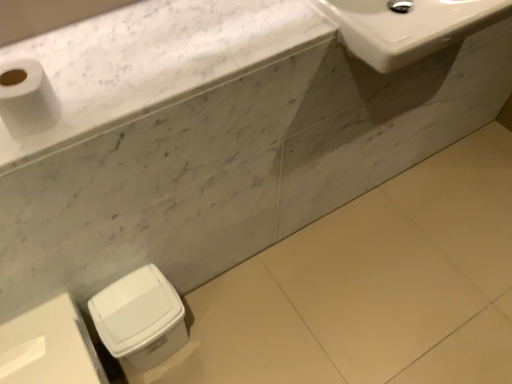
I want to click on white matte toilet paper at upper left, so click(27, 98).

I want to click on white glossy sink at upper right, so click(x=407, y=26).

Describe the element at coordinates (140, 318) in the screenshot. The width and height of the screenshot is (512, 384). I see `white plastic trash can at lower left, marked as the second porcelain in a left-to-right arrangement` at that location.

What is the approximate height of white plastic trash can at lower left, the 2th porcelain from the right?

The height of white plastic trash can at lower left, the 2th porcelain from the right, is 17.52 inches.

The height and width of the screenshot is (384, 512). I want to click on white matte toilet paper at upper left, so click(x=27, y=98).

Is white marble countertop at upper left in contact with white glossy sink at upper right?

white marble countertop at upper left and white glossy sink at upper right are clearly separated.

Which is in front, point (310, 11) or point (414, 50)?

The point (414, 50) is closer to the camera.

From the image's perspective, is white marble countertop at upper left below white glossy sink at upper right?

Indeed, from the image's perspective, white marble countertop at upper left is shown beneath white glossy sink at upper right.

Is the position of white marble countertop at upper left less distant than that of white glossy sink at upper right?

Yes, white marble countertop at upper left is closer to the viewer.

Which is more to the left, white plastic trash can at lower left, marked as the 1th porcelain in a right-to-left arrangement, or white matte toilet paper at upper left?

white matte toilet paper at upper left.

Does point (155, 301) lie behind point (3, 116)?

Yes, it is.

How different are the orientations of white plastic trash can at lower left, marked as the 1th porcelain in a right-to-left arrangement, and white matte toilet paper at upper left in degrees?

The facing directions of white plastic trash can at lower left, marked as the 1th porcelain in a right-to-left arrangement, and white matte toilet paper at upper left are 0.562 degrees apart.

From the image's perspective, which object appears higher, white plastic trash can at lower left, marked as the 1th porcelain in a right-to-left arrangement, or white matte toilet paper at upper left?

white matte toilet paper at upper left.

Where is `porcelain lying above the white plastic trash can at lower left, the 2th porcelain from the right (from the image's perspective)`? This screenshot has width=512, height=384. porcelain lying above the white plastic trash can at lower left, the 2th porcelain from the right (from the image's perspective) is located at coordinates (140, 318).

Considering the positions of points (66, 356) and (174, 337), is point (66, 356) farther from camera compared to point (174, 337)?

No, (66, 356) is in front of (174, 337).

From the image's perspective, who appears lower, white plastic trash can at lower left, the 2th porcelain from the right, or white plastic trash can at lower left, marked as the second porcelain in a left-to-right arrangement?

white plastic trash can at lower left, the 2th porcelain from the right.

Looking at this image, from a real-world perspective, is white plastic trash can at lower left, the first porcelain viewed from the left, positioned under white matte toilet paper at upper left based on gravity?

Yes, from a real-world perspective, white plastic trash can at lower left, the first porcelain viewed from the left, is beneath white matte toilet paper at upper left.

Does point (90, 375) appear closer or farther from the camera than point (32, 108)?

Point (90, 375) is positioned farther from the camera compared to point (32, 108).

Considering their positions, is white plastic trash can at lower left, the 2th porcelain from the right, located in front of or behind white matte toilet paper at upper left?

Visually, white plastic trash can at lower left, the 2th porcelain from the right, is located behind white matte toilet paper at upper left.

Is white plastic trash can at lower left, the 2th porcelain from the right, looking in the opposite direction of white matte toilet paper at upper left?

white plastic trash can at lower left, the 2th porcelain from the right, does not have its back to white matte toilet paper at upper left.

Is white plastic trash can at lower left, marked as the 1th porcelain in a right-to-left arrangement, spatially inside white marble countertop at upper left, or outside of it?

white plastic trash can at lower left, marked as the 1th porcelain in a right-to-left arrangement, exists outside the volume of white marble countertop at upper left.

This screenshot has height=384, width=512. I want to click on the 1st porcelain positioned below the white marble countertop at upper left (from the image's perspective), so pos(140,318).

From the image's perspective, does white plastic trash can at lower left, marked as the 1th porcelain in a right-to-left arrangement, appear higher than white marble countertop at upper left?

No, from the image's perspective, white plastic trash can at lower left, marked as the 1th porcelain in a right-to-left arrangement, is not on top of white marble countertop at upper left.

Is white plastic trash can at lower left, marked as the second porcelain in a left-to-right arrangement, oriented away from white marble countertop at upper left?

That's not correct — white plastic trash can at lower left, marked as the second porcelain in a left-to-right arrangement, is not looking away from white marble countertop at upper left.

In the scene shown: Is white marble countertop at upper left directly adjacent to white matte toilet paper at upper left?

There is a gap between white marble countertop at upper left and white matte toilet paper at upper left.

Could you measure the distance between white marble countertop at upper left and white matte toilet paper at upper left?

white marble countertop at upper left is 9.57 inches away from white matte toilet paper at upper left.

Is white marble countertop at upper left closer to the viewer compared to white matte toilet paper at upper left?

No, white marble countertop at upper left is further to the viewer.

Which is in front, point (220, 52) or point (11, 108)?

The point (11, 108) is in front.

Considering the relative sizes of white glossy sink at upper right and white marble countertop at upper left in the image provided, is white glossy sink at upper right wider than white marble countertop at upper left?

Indeed, white glossy sink at upper right has a greater width compared to white marble countertop at upper left.

Between white glossy sink at upper right and white marble countertop at upper left, which one has larger size?

Bigger between the two is white glossy sink at upper right.

How distant is white glossy sink at upper right from white marble countertop at upper left?

29.35 centimeters.

Can you see white glossy sink at upper right touching white marble countertop at upper left?

No, white glossy sink at upper right is not next to white marble countertop at upper left.

This screenshot has width=512, height=384. I want to click on counter top above the white glossy sink at upper right (from a real-world perspective), so click(x=153, y=61).

This screenshot has width=512, height=384. I want to click on toilet paper above the white plastic trash can at lower left, marked as the second porcelain in a left-to-right arrangement (from the image's perspective), so click(x=27, y=98).

Which object lies nearer to the anchor point white glossy sink at upper right, white plastic trash can at lower left, marked as the 1th porcelain in a right-to-left arrangement, or white matte toilet paper at upper left?

white matte toilet paper at upper left is positioned closer to the anchor white glossy sink at upper right.

Estimate the real-world distances between objects in this image. Which object is further from white matte toilet paper at upper left, white marble countertop at upper left or white plastic trash can at lower left, marked as the second porcelain in a left-to-right arrangement?

Among the two, white plastic trash can at lower left, marked as the second porcelain in a left-to-right arrangement, is located further to white matte toilet paper at upper left.

Estimate the real-world distances between objects in this image. Which object is further from white glossy sink at upper right, white marble countertop at upper left or white matte toilet paper at upper left?

white matte toilet paper at upper left is positioned further to the anchor white glossy sink at upper right.

From the image, which object appears to be nearer to white plastic trash can at lower left, marked as the second porcelain in a left-to-right arrangement, white plastic trash can at lower left, the first porcelain viewed from the left, or white glossy sink at upper right?

white plastic trash can at lower left, the first porcelain viewed from the left, lies closer to white plastic trash can at lower left, marked as the second porcelain in a left-to-right arrangement, than the other object.

Based on their spatial positions, is white marble countertop at upper left or white glossy sink at upper right further from white matte toilet paper at upper left?

Among the two, white glossy sink at upper right is located further to white matte toilet paper at upper left.

Estimate the real-world distances between objects in this image. Which object is closer to white glossy sink at upper right, white plastic trash can at lower left, the 2th porcelain from the right, or white matte toilet paper at upper left?

white matte toilet paper at upper left lies closer to white glossy sink at upper right than the other object.

When comparing their distances from white marble countertop at upper left, does white glossy sink at upper right or white plastic trash can at lower left, marked as the second porcelain in a left-to-right arrangement, seem closer?

white glossy sink at upper right lies closer to white marble countertop at upper left than the other object.

Based on their spatial positions, is white plastic trash can at lower left, the first porcelain viewed from the left, or white matte toilet paper at upper left further from white plastic trash can at lower left, marked as the second porcelain in a left-to-right arrangement?

Based on the image, white matte toilet paper at upper left appears to be further to white plastic trash can at lower left, marked as the second porcelain in a left-to-right arrangement.

Where is `counter top between white matte toilet paper at upper left and white glossy sink at upper right in the horizontal direction`? counter top between white matte toilet paper at upper left and white glossy sink at upper right in the horizontal direction is located at coordinates (153, 61).

I want to click on porcelain between white marble countertop at upper left and white plastic trash can at lower left, the first porcelain viewed from the left, in the up-down direction, so click(140, 318).

Locate an element on the screen. The height and width of the screenshot is (384, 512). porcelain between white glossy sink at upper right and white plastic trash can at lower left, the 2th porcelain from the right, vertically is located at coordinates (140, 318).

Locate an element on the screen. The image size is (512, 384). toilet paper between white glossy sink at upper right and white plastic trash can at lower left, marked as the 1th porcelain in a right-to-left arrangement, in the up-down direction is located at coordinates (27, 98).